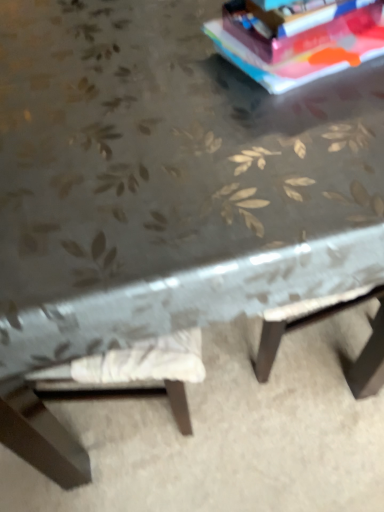
Question: Is matte paper at upper right in front of or behind white fabric cushion at lower left in the image?

Choices:
 (A) front
 (B) behind

Answer: (A)

Question: Based on their positions, is matte paper at upper right located to the left or right of white fabric cushion at lower left?

Choices:
 (A) right
 (B) left

Answer: (A)

Question: Considering the positions of point (311, 41) and point (273, 403), is point (311, 41) closer or farther from the camera than point (273, 403)?

Choices:
 (A) closer
 (B) farther

Answer: (A)

Question: From the image's perspective, relative to matte paper at upper right, is white fabric cushion at lower left above or below?

Choices:
 (A) above
 (B) below

Answer: (B)

Question: Relative to matte paper at upper right, is white fabric cushion at lower left in front or behind?

Choices:
 (A) behind
 (B) front

Answer: (A)

Question: From a real-world perspective, is white fabric cushion at lower left physically located above or below matte paper at upper right?

Choices:
 (A) below
 (B) above

Answer: (A)

Question: Looking at the image, does white fabric cushion at lower left seem bigger or smaller compared to matte paper at upper right?

Choices:
 (A) big
 (B) small

Answer: (A)